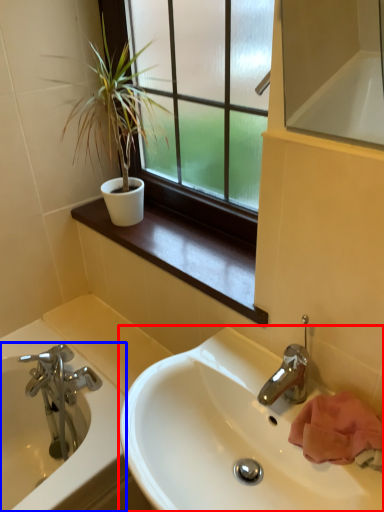
Question: Which point is further to the camera, sink (highlighted by a red box) or bathtub (highlighted by a blue box)?

Choices:
 (A) sink
 (B) bathtub

Answer: (B)